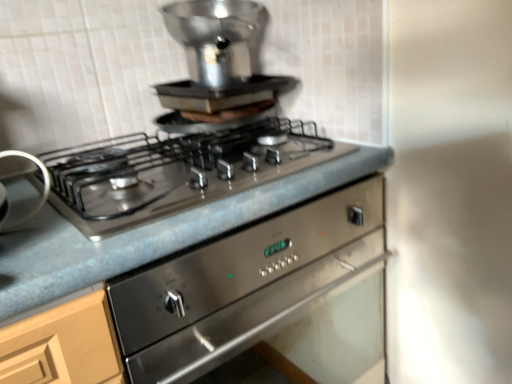
Find the location of a particular element. The width and height of the screenshot is (512, 384). vacant area on the back side of satin silver burner at left, placed as the 1th appliance when sorted from left to right is located at coordinates (27, 188).